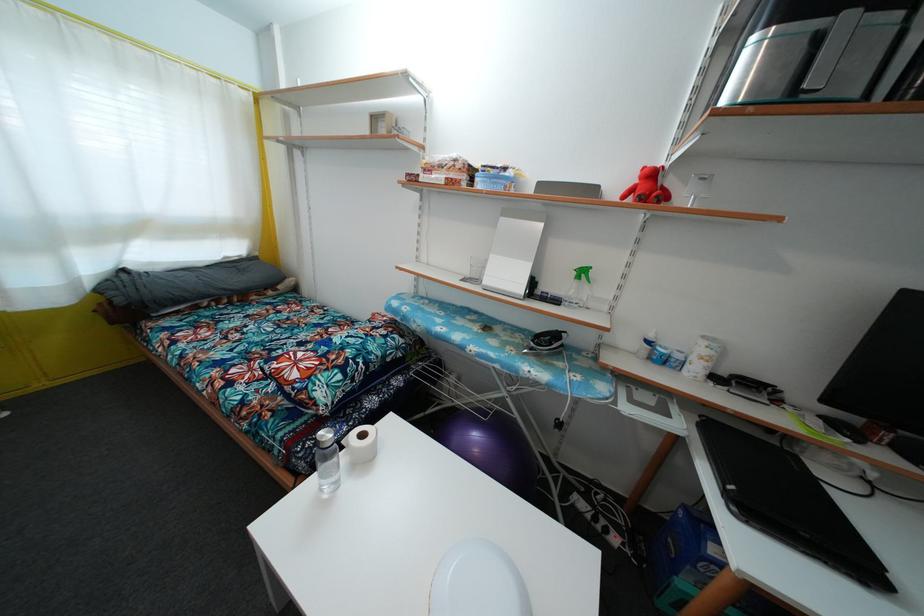
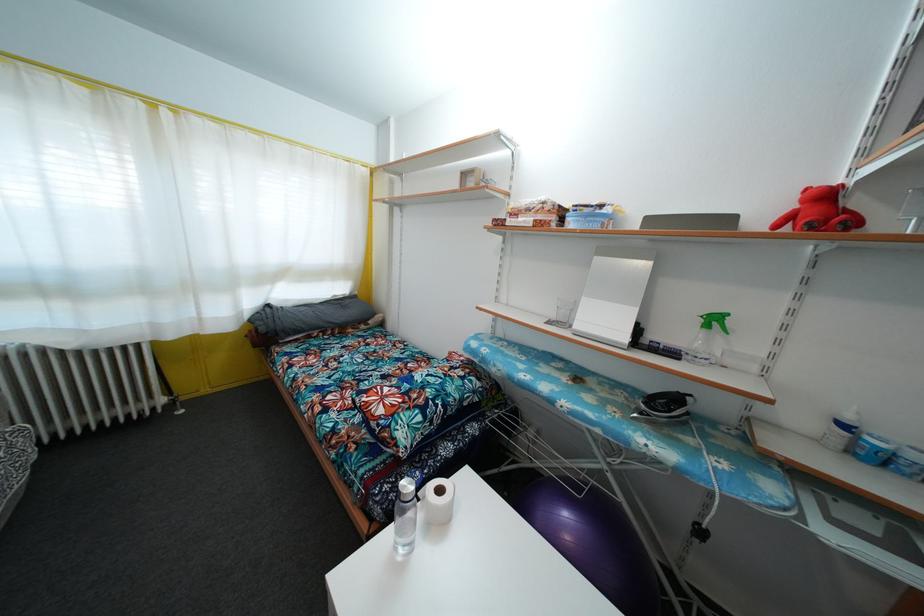
Find the pixel in the second image that matches point 330,440 in the first image.

(410, 492)